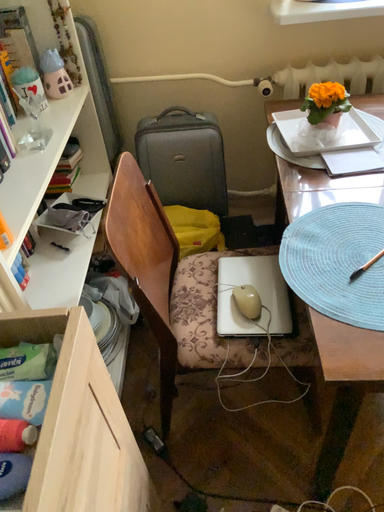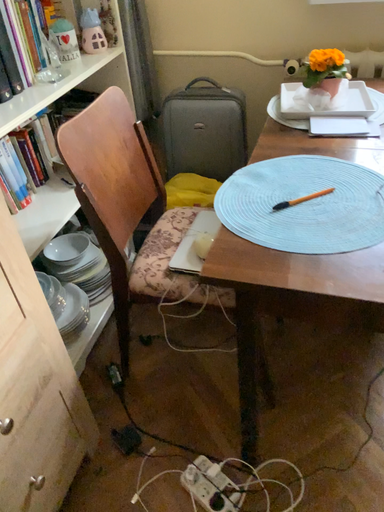
Question: Which way did the camera rotate in the video?

Choices:
 (A) rotated left
 (B) rotated right

Answer: (A)